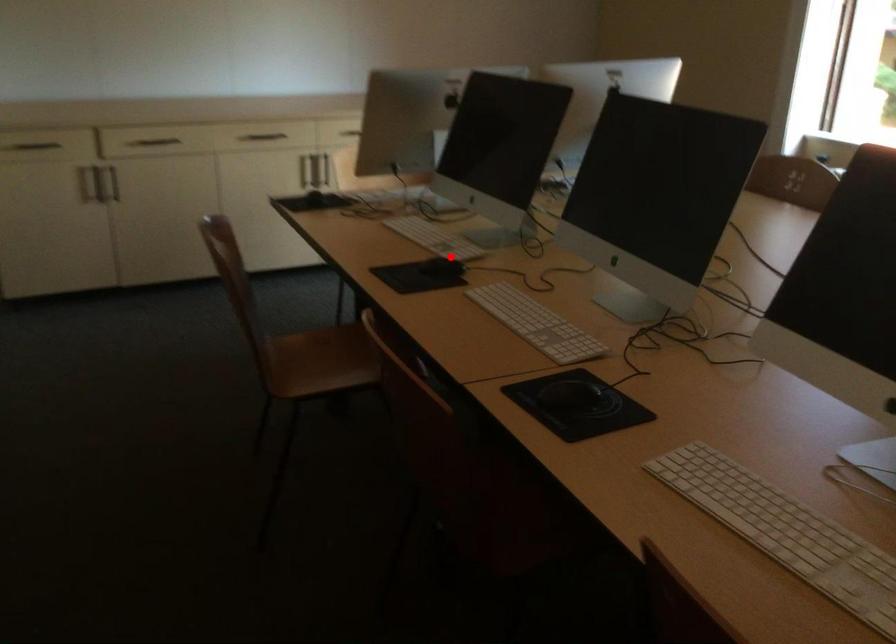
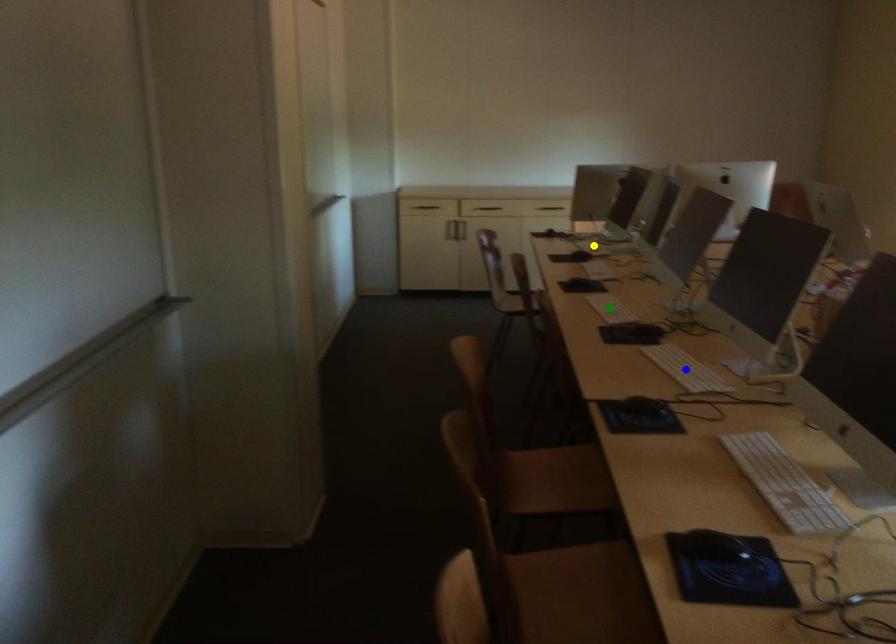
Question: I am providing you with two images of the same scene from different viewpoints. A red point is marked on the first image. You are given multiple points on the second image. Which point in image 2 represents the same 3d spot as the red point in image 1?

Choices:
 (A) yellow point
 (B) blue point
 (C) green point

Answer: (A)